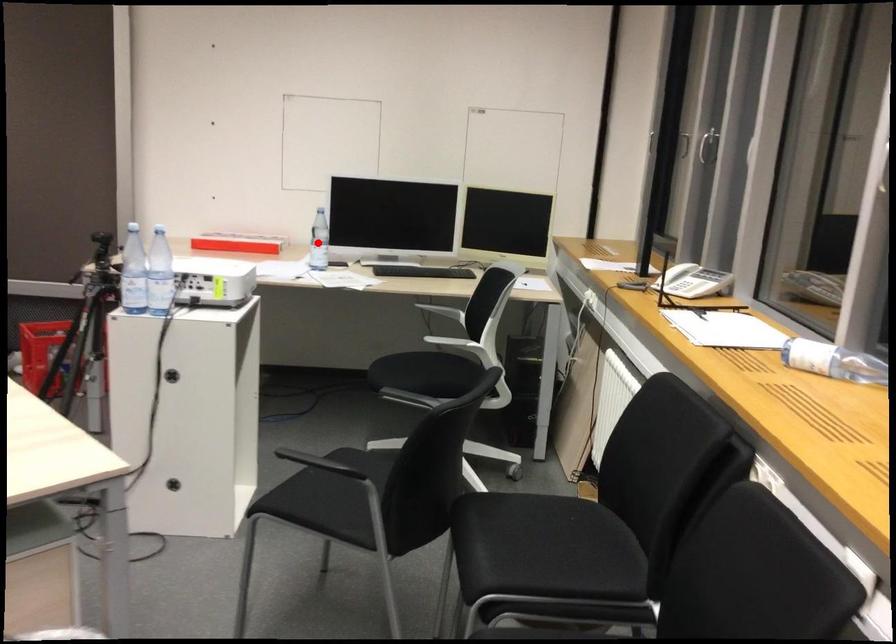
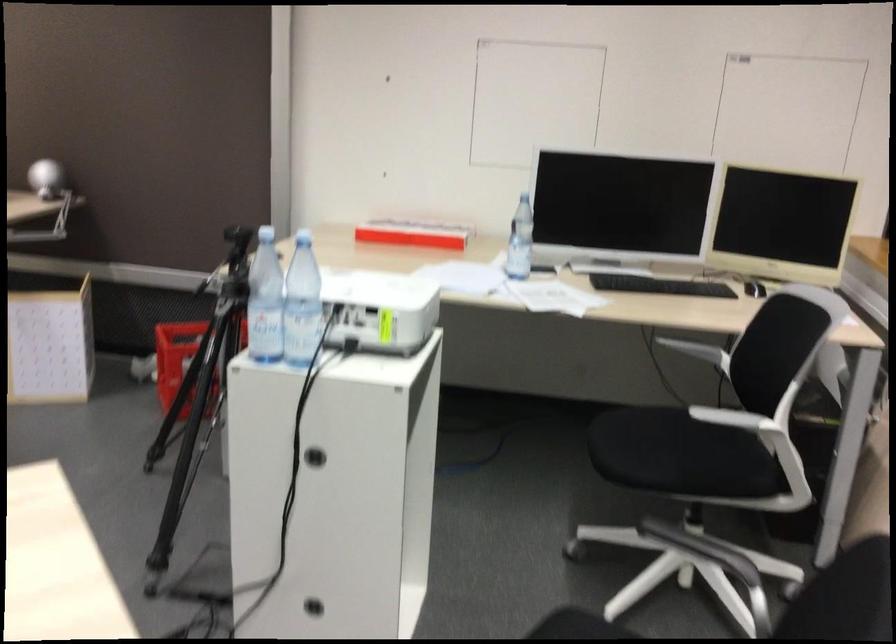
Question: I am providing you with two images of the same scene from different viewpoints. A red point is marked on the first image. At the location where the point appears in image 1, is it still visible in image 2?

Choices:
 (A) Yes
 (B) No

Answer: (A)